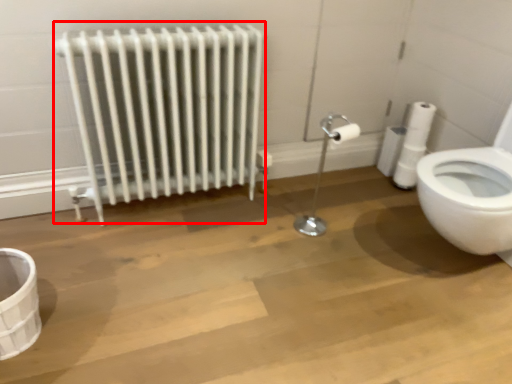
Question: From the image's perspective, where is radiator (annotated by the red box) located in relation to toilet paper in the image?

Choices:
 (A) above
 (B) below

Answer: (B)